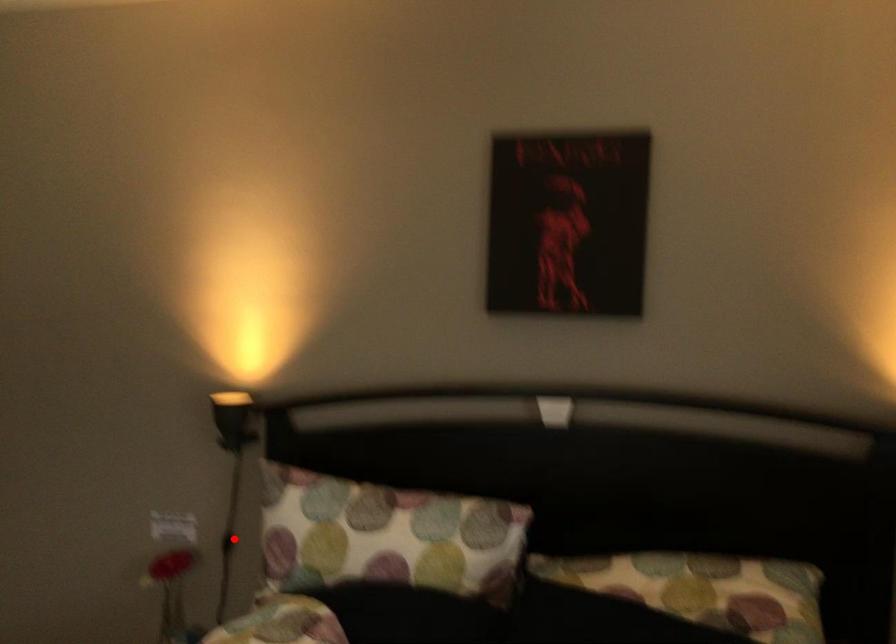
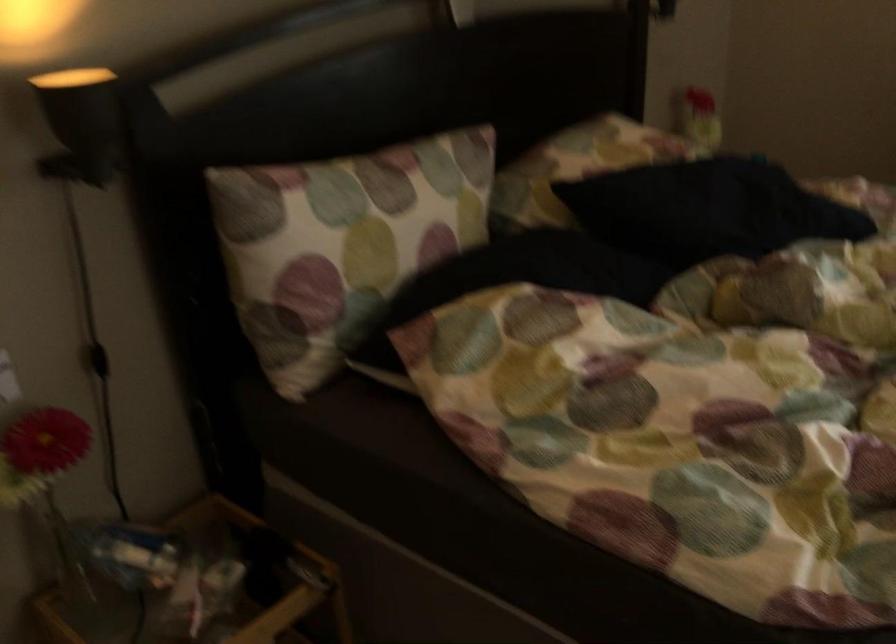
Question: I am providing you with two images of the same scene from different viewpoints. Given a red point in image1, look at the same physical point in image2. Is it:

Choices:
 (A) Closer to the viewpoint
 (B) Farther from the viewpoint

Answer: (A)